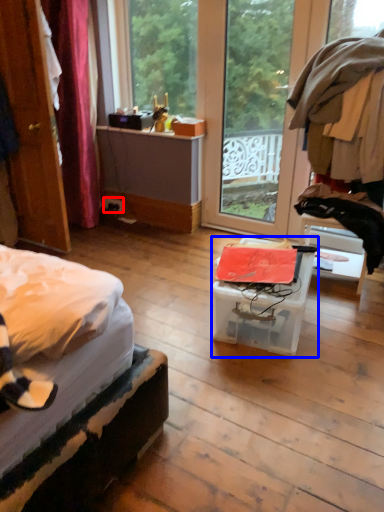
Question: Which point is closer to the camera, power outlet (highlighted by a red box) or box (highlighted by a blue box)?

Choices:
 (A) power outlet
 (B) box

Answer: (B)